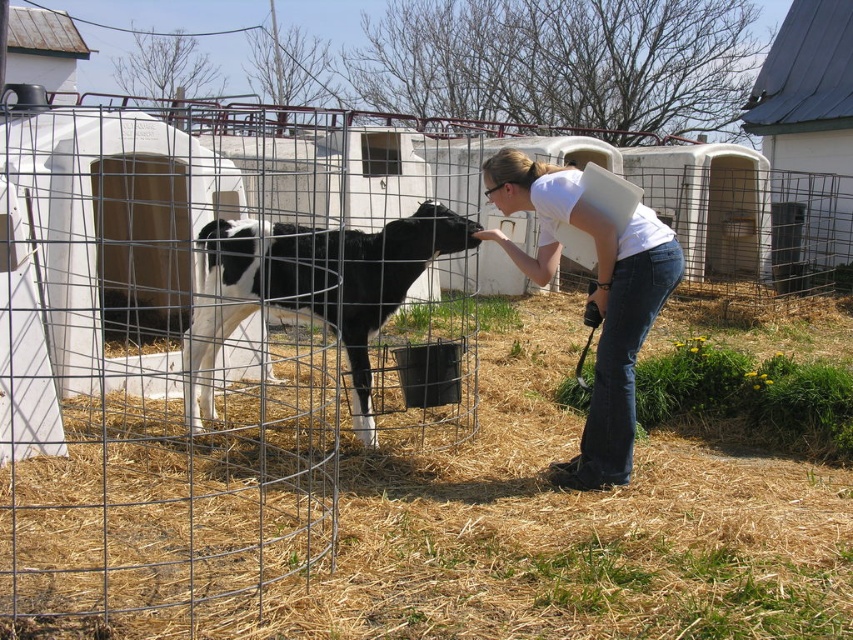
You are a photographer standing at the camera position in the scene. You want to take a closeup photo of the black and white fur at center. The camera has a minimum focusing distance of 2 meters. Can you take the photo without moving closer than 2 meters?

The black and white fur at center is 3.32 meters away from the camera. Since the minimum focusing distance is 2 meters, the photographer can take the photo without moving closer because the subject is beyond the minimum distance.

You are standing in front of the farm scene and want to take a photo of the calf. You notice two points marked in the image. Which point is closer to you, point (393, 243) or point (639, 310)?

Point (393, 243) is closer to you because it is further to the viewer than point (639, 310).

You are a farmer who needs to clean the calf area. You have a pitchfork that can reach 4 feet. The calf is currently near the black and white fur at center. Can you reach the dry straw at lower center with your pitchfork without moving the calf?

The distance between dry straw at lower center and black and white fur at center is 4.38 feet. Since your pitchfork can only reach 4 feet, you cannot reach the dry straw at lower center without moving the calf.